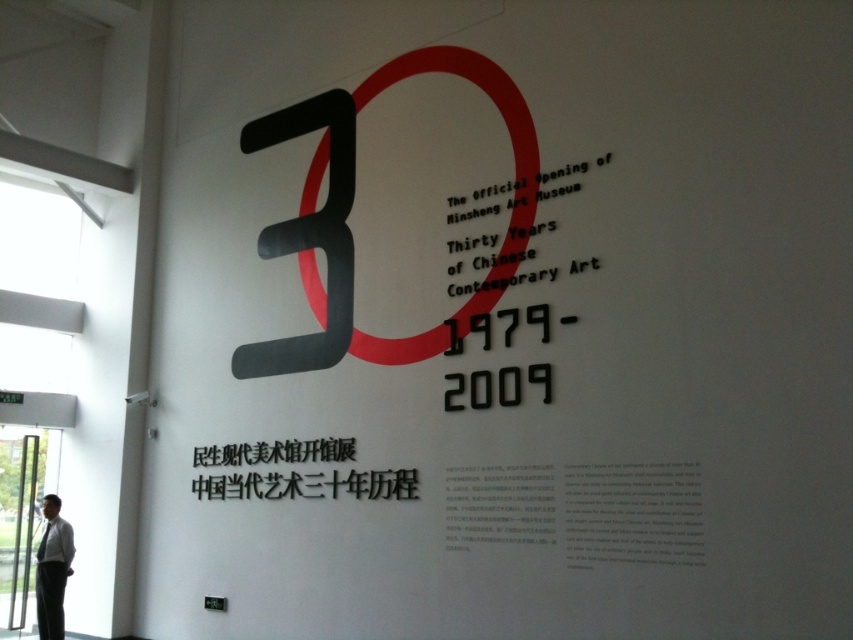
The scene has a point labeled as point (511, 148). What object is located at that point?

The point (511, 148) corresponds to the matte red circle at center.